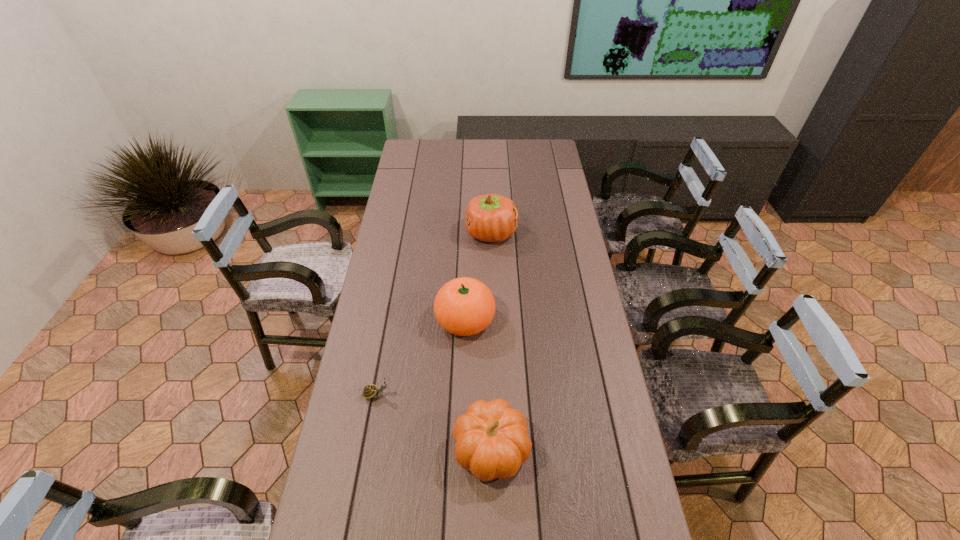
Identify the location of vacant space in between the farthest pumpkin and the nearest object. (492, 341).

Where is `empty space between the second farthest object and the farthest pumpkin`? The height and width of the screenshot is (540, 960). empty space between the second farthest object and the farthest pumpkin is located at coordinates (478, 276).

You are a GUI agent. You are given a task and a screenshot of the screen. Output one action in this format:
    pyautogui.click(x=<x>, y=<y>)
    Task: Click on the blank region between the second nearest pumpkin and the nearest object
    
    Given the screenshot: What is the action you would take?
    pyautogui.click(x=478, y=384)

Find the location of a particular element. This screenshot has height=540, width=960. empty location between the second nearest object and the nearest object is located at coordinates (434, 422).

At what (x,y) coordinates should I click in order to perform the action: click on object that is the third nearest to the shortest object. Please return your answer as a coordinate pair (x, y). This screenshot has width=960, height=540. Looking at the image, I should click on (492, 218).

At what (x,y) coordinates should I click in order to perform the action: click on the third closest object to the farthest pumpkin. Please return your answer as a coordinate pair (x, y). This screenshot has height=540, width=960. Looking at the image, I should click on (491, 438).

Locate an element on the screen. pumpkin that is the closest to the third nearest object is located at coordinates (491, 438).

Locate which pumpkin is the second closest to the shortest object. Please provide its 2D coordinates. Your answer should be formatted as a tuple, i.e. [(x, y)], where the tuple contains the x and y coordinates of a point satisfying the conditions above.

[(464, 306)]

Where is `blank space that satisfies the following two spatial constraints: 1. on the side of the farthest object with the cute face; 2. on the front side of the third nearest object`? This screenshot has width=960, height=540. blank space that satisfies the following two spatial constraints: 1. on the side of the farthest object with the cute face; 2. on the front side of the third nearest object is located at coordinates (493, 319).

You are a GUI agent. You are given a task and a screenshot of the screen. Output one action in this format:
    pyautogui.click(x=<x>, y=<y>)
    Task: Click on the free region that satisfies the following two spatial constraints: 1. on the side of the farthest object with the cute face; 2. on the front side of the nearest pumpkin
    Image resolution: width=960 pixels, height=540 pixels.
    Given the screenshot: What is the action you would take?
    pyautogui.click(x=497, y=449)